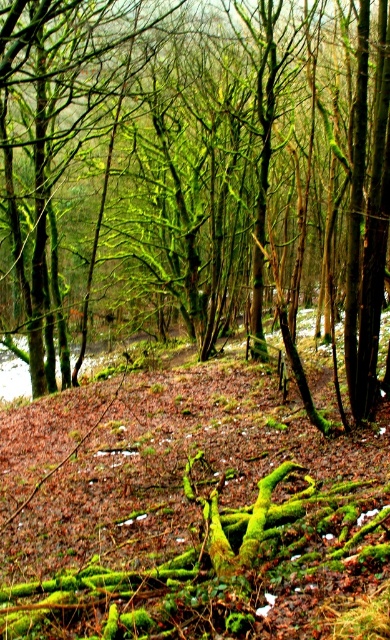
Question: Which object is farther from the camera taking this photo?

Choices:
 (A) green mossy roots at lower center
 (B) green mossy tree at center

Answer: (B)

Question: Can you confirm if green mossy tree at center is positioned below green mossy roots at lower center?

Choices:
 (A) yes
 (B) no

Answer: (B)

Question: Which point is farther from the camera taking this photo?

Choices:
 (A) (297, 33)
 (B) (152, 520)

Answer: (A)

Question: Which of the following is the farthest from the observer?

Choices:
 (A) coord(1,60)
 (B) coord(122,518)

Answer: (B)

Question: Does green mossy tree at center appear over green mossy roots at lower center?

Choices:
 (A) no
 (B) yes

Answer: (B)

Question: Can you confirm if green mossy tree at center is positioned below green mossy roots at lower center?

Choices:
 (A) no
 (B) yes

Answer: (A)